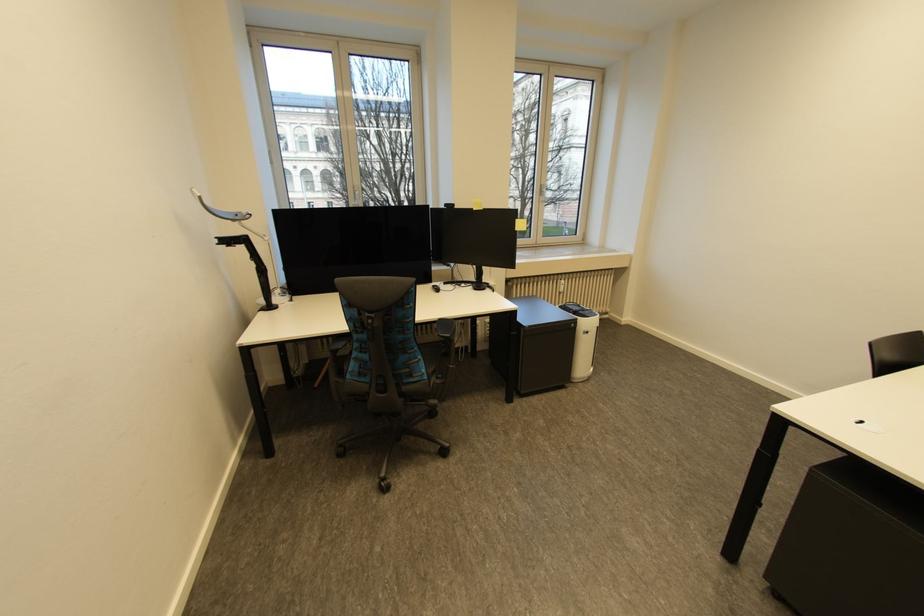
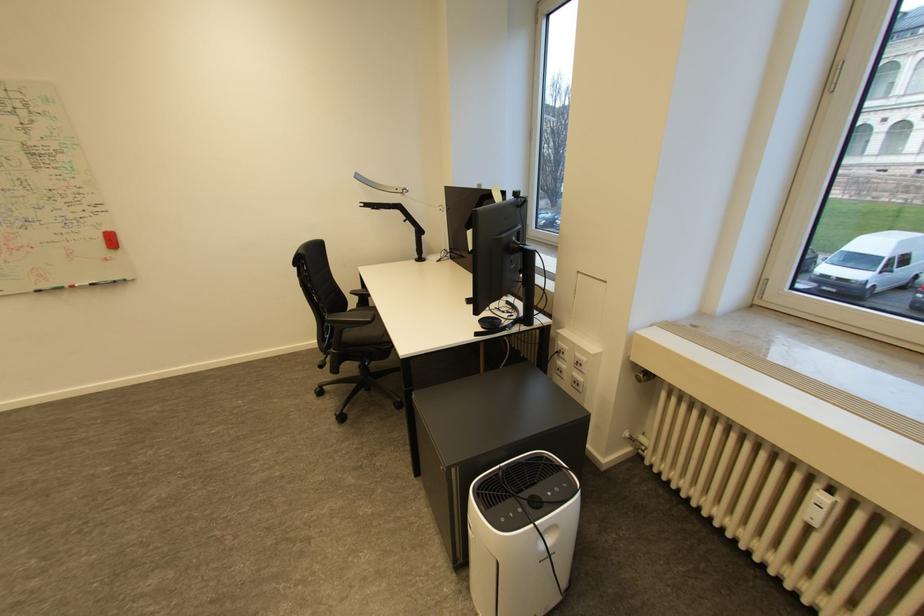
The point at (566, 294) is marked in the first image. Where is the corresponding point in the second image?

(816, 525)